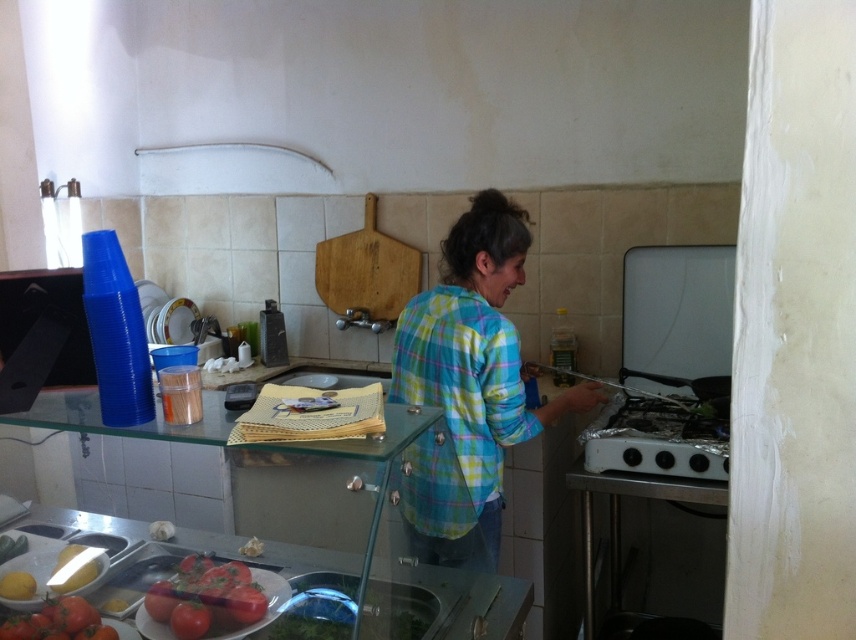
Question: Which of the following is the closest to the observer?

Choices:
 (A) (349, 586)
 (B) (669, 529)
 (C) (152, 154)
 (D) (199, 620)

Answer: (D)

Question: Estimate the real-world distances between objects in this image. Which object is closer to the white matte exhaust hood at upper center?

Choices:
 (A) plaid fabric shirt at center
 (B) plaid cotton shirt at center
 (C) white glossy oven at right

Answer: (A)

Question: Considering the relative positions of white glossy oven at right and ripe red tomato at lower left in the image provided, where is white glossy oven at right located with respect to ripe red tomato at lower left?

Choices:
 (A) above
 (B) below

Answer: (A)

Question: Is white glossy oven at right wider than plaid fabric shirt at center?

Choices:
 (A) yes
 (B) no

Answer: (B)

Question: Which point is farther to the camera?

Choices:
 (A) ripe red tomato at lower left
 (B) silver metallic gas stove at lower right
 (C) metallic stainless steel counter at lower center
 (D) plaid cotton shirt at center

Answer: (B)

Question: Can you confirm if plaid fabric shirt at center is positioned to the left of white matte exhaust hood at upper center?

Choices:
 (A) no
 (B) yes

Answer: (A)